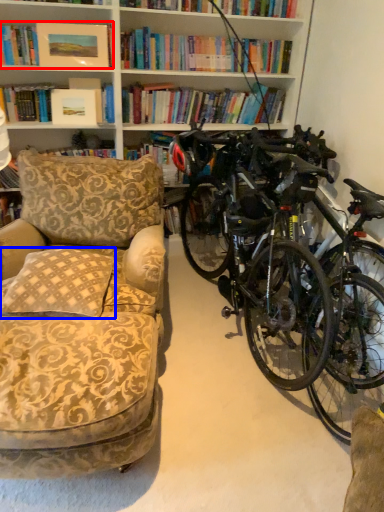
Question: Which of the following is the farthest to the observer, book (highlighted by a red box) or pillow (highlighted by a blue box)?

Choices:
 (A) book
 (B) pillow

Answer: (A)